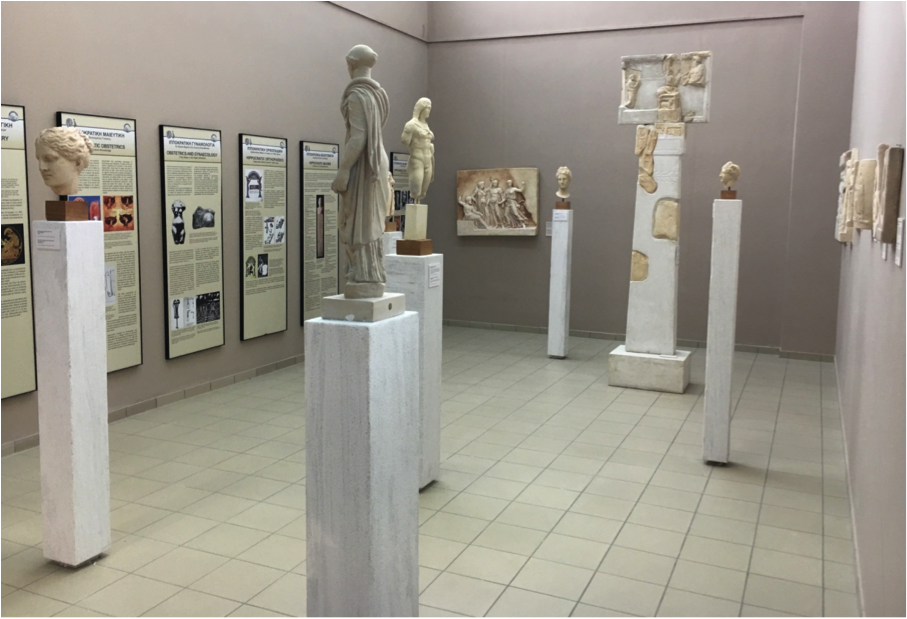
The width and height of the screenshot is (907, 619). I want to click on floor, so click(x=589, y=538).